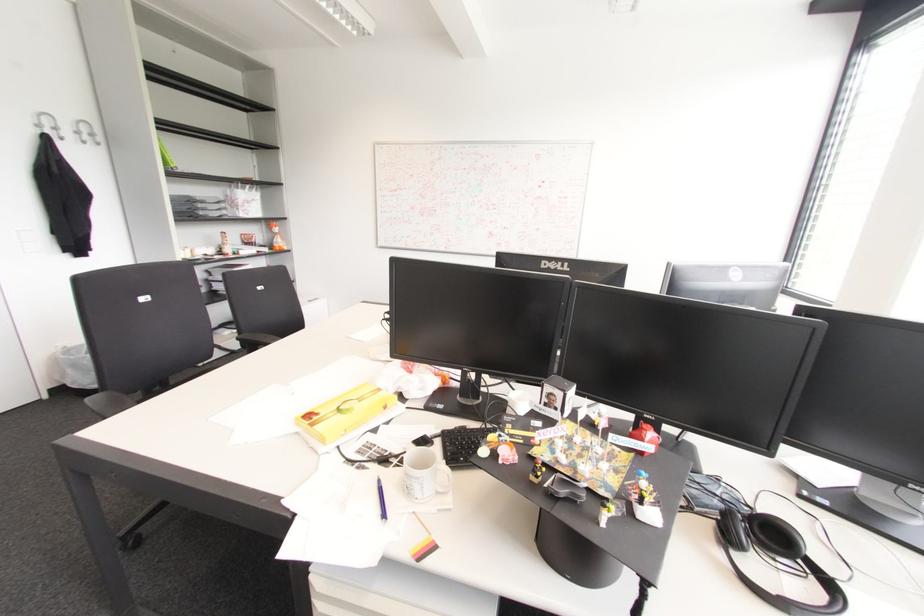
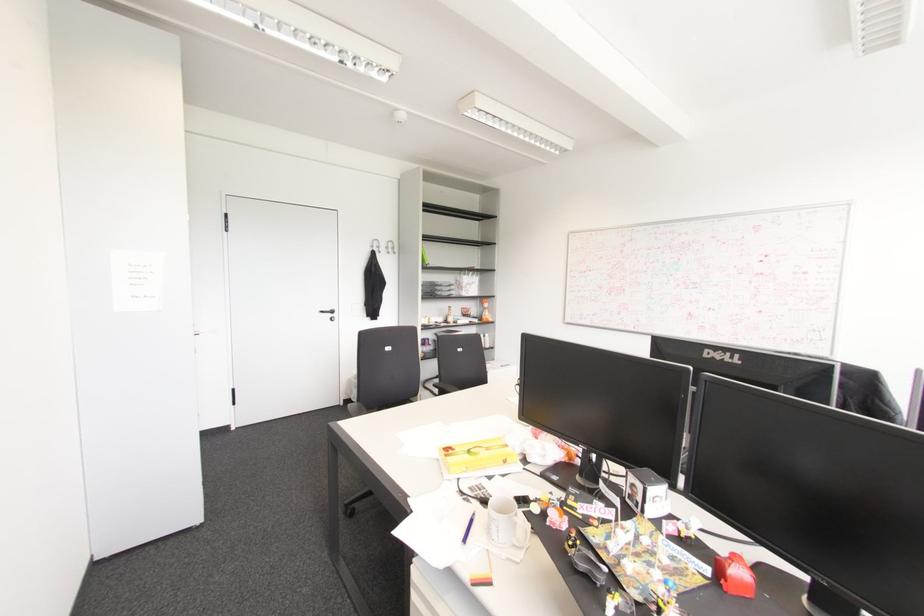
Find the pixel in the second image that matches point (379, 480) in the first image.

(472, 514)